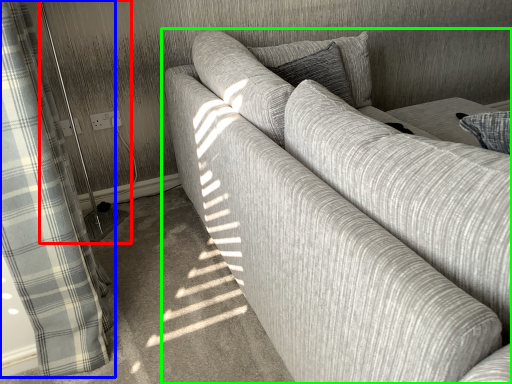
Question: Based on their relative distances, which object is nearer to screen door (highlighted by a red box)? Choose from curtain (highlighted by a blue box) and studio couch (highlighted by a green box).

Choices:
 (A) curtain
 (B) studio couch

Answer: (A)